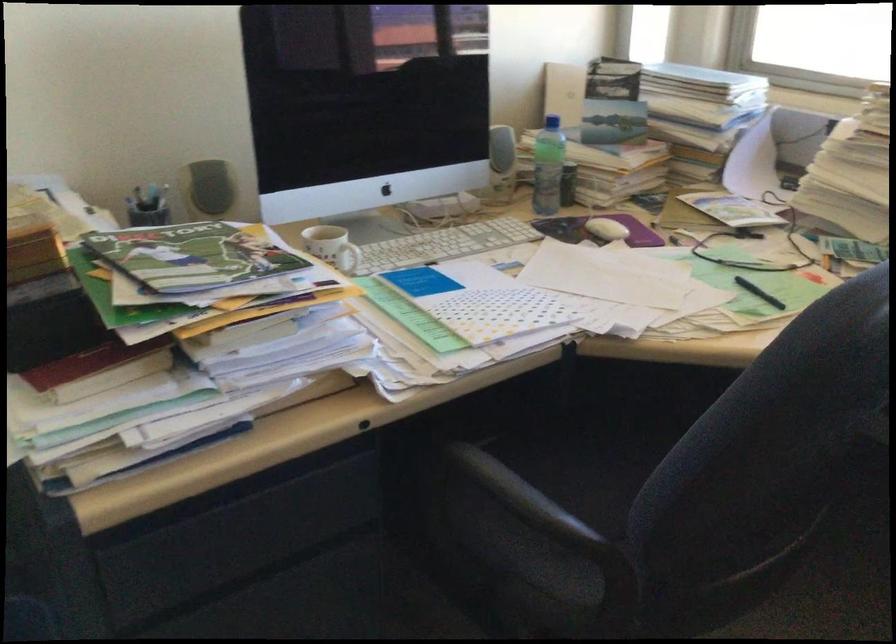
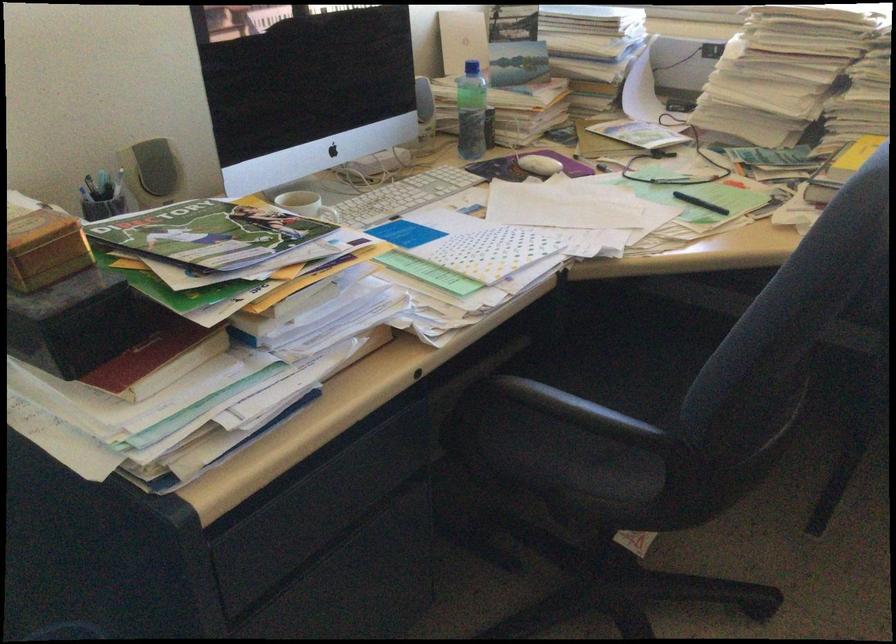
Where in the second image is the point corresponding to [755,295] from the first image?

(700, 203)